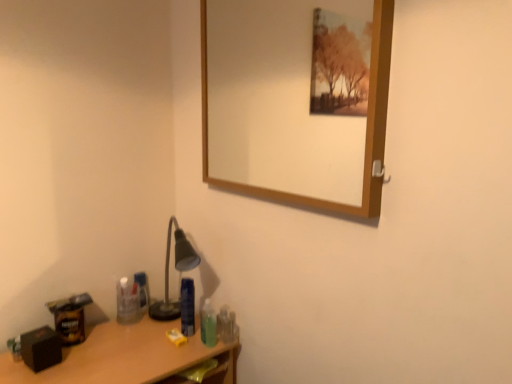
Locate an element on the screen. vacant point above wooden desk at lower left (from a real-world perspective) is located at coordinates (114, 348).